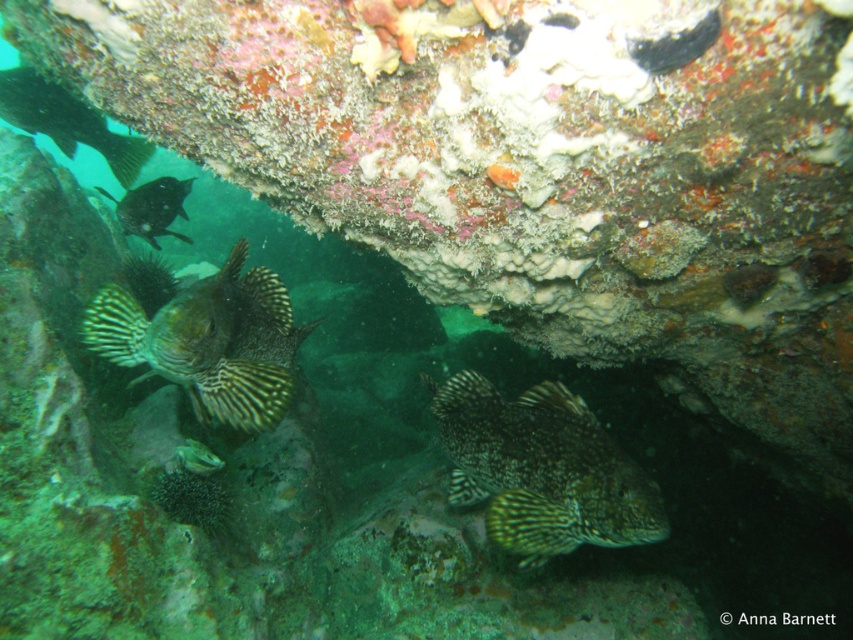
Question: Among these objects, which one is nearest to the camera?

Choices:
 (A) green striped fish at center
 (B) green striped fish at upper left
 (C) green speckled fish at center

Answer: (A)

Question: Which object appears closest to the camera in this image?

Choices:
 (A) green striped fish at center
 (B) green striped fish at upper left
 (C) green speckled fish at center
 (D) shiny black fish at upper left

Answer: (A)

Question: Is green striped fish at center smaller than shiny black fish at upper left?

Choices:
 (A) no
 (B) yes

Answer: (A)

Question: Estimate the real-world distances between objects in this image. Which object is farther from the green striped fish at center?

Choices:
 (A) shiny black fish at upper left
 (B) green speckled fish at center

Answer: (A)

Question: Is green striped fish at upper left positioned in front of shiny black fish at upper left?

Choices:
 (A) no
 (B) yes

Answer: (B)

Question: Can you confirm if green speckled fish at center is bigger than shiny black fish at upper left?

Choices:
 (A) no
 (B) yes

Answer: (B)